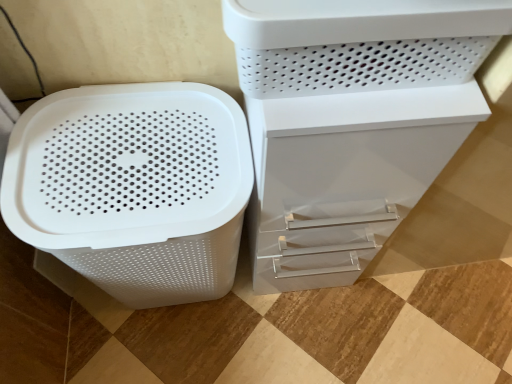
Find the location of a particular element. free space above white matte plastic basket at left (from a real-world perspective) is located at coordinates (133, 157).